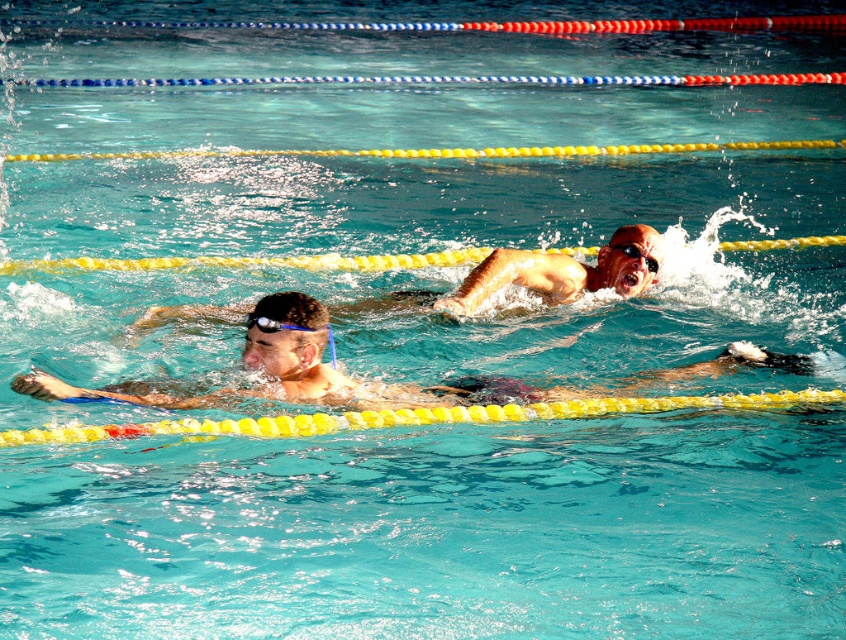
You are a lifeguard observing the two swimmers in the pool. You notice the smooth skin swimmer at center and the black matte swim cap at upper center. Which object is wider in the image?

The smooth skin swimmer at center might be wider than the black matte swim cap at upper center, so the smooth skin swimmer at center is likely wider.

You are a lifeguard observing the two swimmers in the pool. You notice the black matte swim cap at upper center and the black rubber goggles at center. Which object is bigger in size?

The black matte swim cap at upper center is larger in size than the black rubber goggles at center.

You are a photographer standing at the edge of the pool. You want to take a closeup photo of the smooth skin swimmer at center. The camera you are using has a maximum focus range of 3 meters. Can you take the photo without moving closer?

The smooth skin swimmer at center and camera are 3.85 meters apart from each other. Since the camera can only focus up to 3 meters, you cannot take the photo without moving closer.